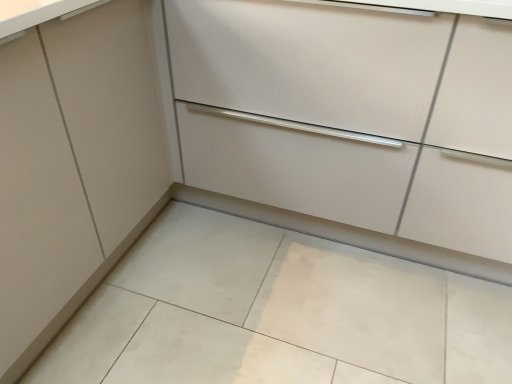
What is the approximate width of matte white cupboard at center?

matte white cupboard at center is 25.42 inches wide.

At what (x,y) coordinates should I click in order to perform the action: click on matte white cupboard at center. Please return your answer as a coordinate pair (x, y). This screenshot has height=384, width=512. Looking at the image, I should click on (350, 115).

This screenshot has height=384, width=512. Describe the element at coordinates (350, 115) in the screenshot. I see `matte white cupboard at center` at that location.

You are a GUI agent. You are given a task and a screenshot of the screen. Output one action in this format:
    pyautogui.click(x=<x>, y=<y>)
    Task: Click on the matte white cupboard at center
    The height and width of the screenshot is (384, 512).
    Given the screenshot: What is the action you would take?
    pyautogui.click(x=350, y=115)